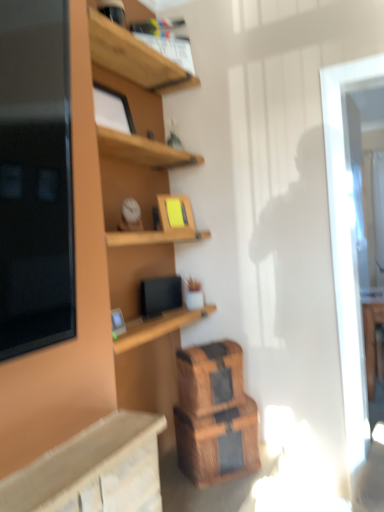
Question: Based on their sizes in the image, would you say wooden shelf at upper center is bigger or smaller than wooden crate at lower center, positioned as the 1th crate in bottom-to-top order?

Choices:
 (A) small
 (B) big

Answer: (A)

Question: Is point (187, 79) positioned closer to the camera than point (175, 407)?

Choices:
 (A) closer
 (B) farther

Answer: (B)

Question: Estimate the real-world distances between objects in this image. Which object is closer to the wooden shelf at upper center?

Choices:
 (A) wooden crate at lower center, acting as the 2th crate starting from the top
 (B) transparent glass door at right
 (C) wooden crate at lower center, the 1th crate positioned from the top

Answer: (B)

Question: Considering the real-world distances, which object is farthest from the wooden crate at lower center, positioned as the 1th crate in bottom-to-top order?

Choices:
 (A) wooden shelf at upper center
 (B) transparent glass door at right
 (C) wooden crate at lower center, the 1th crate positioned from the top

Answer: (A)